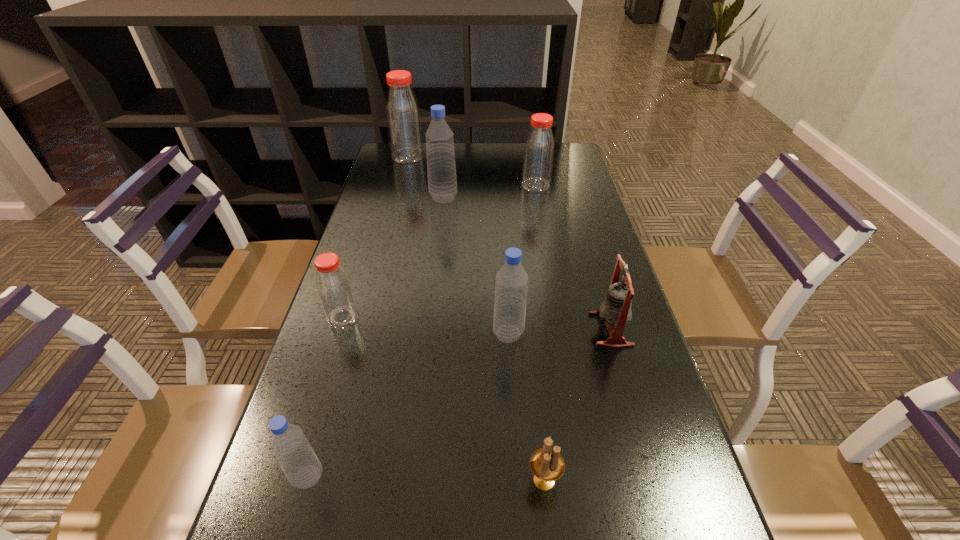
The image size is (960, 540). What are the coordinates of `the fourth bottle from left to right` in the screenshot? It's located at (442, 183).

Where is `the fourth object from left to right`? Image resolution: width=960 pixels, height=540 pixels. the fourth object from left to right is located at coordinates (442, 183).

Identify the location of the farthest object. The width and height of the screenshot is (960, 540). (403, 118).

Locate an element on the screen. The height and width of the screenshot is (540, 960). the farthest red bottle is located at coordinates (x=403, y=118).

I want to click on the second object from right to left, so click(538, 156).

Image resolution: width=960 pixels, height=540 pixels. Find the location of `the second biggest red bottle`. the second biggest red bottle is located at coordinates (538, 156).

Locate an element on the screen. the second nearest blue bottle is located at coordinates (511, 285).

You are a GUI agent. You are given a task and a screenshot of the screen. Output one action in this format:
    pyautogui.click(x=<x>, y=<y>)
    Task: Click on the second biggest blue bottle
    The height and width of the screenshot is (540, 960).
    Given the screenshot: What is the action you would take?
    pyautogui.click(x=511, y=285)

At what (x,y) coordinates should I click in order to perform the action: click on bell. Please return your answer as a coordinate pair (x, y). The height and width of the screenshot is (540, 960). Looking at the image, I should click on (616, 308).

The width and height of the screenshot is (960, 540). Find the location of `the smallest red bottle`. the smallest red bottle is located at coordinates (334, 288).